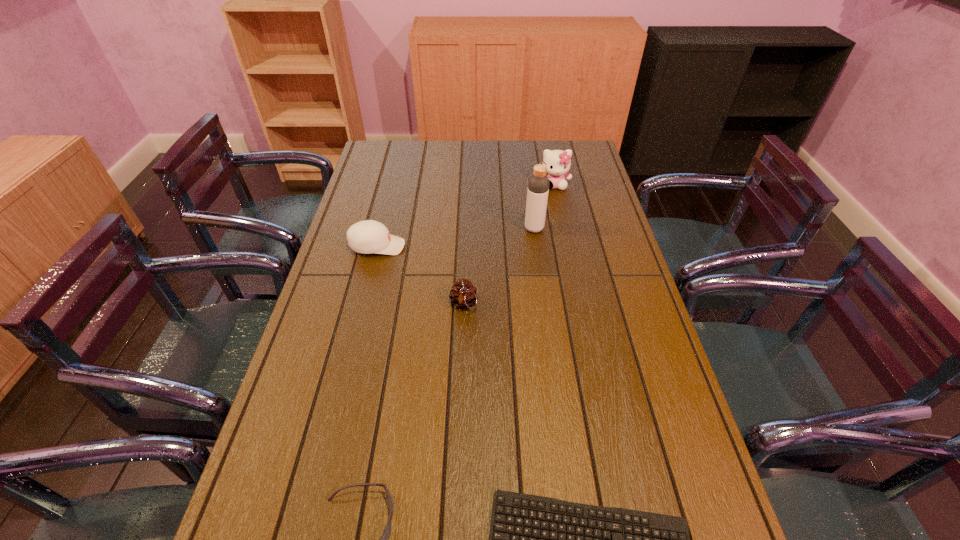
At what (x,y) coordinates should I click in order to perform the action: click on bottle. Please return your answer as a coordinate pair (x, y). Image resolution: width=960 pixels, height=540 pixels. Looking at the image, I should click on (538, 184).

Where is `the fifth shortest object`? This screenshot has width=960, height=540. the fifth shortest object is located at coordinates (558, 162).

At what (x,y) coordinates should I click in order to perform the action: click on the farthest object. Please return your answer as a coordinate pair (x, y). Looking at the image, I should click on (558, 162).

Locate an element on the screen. The height and width of the screenshot is (540, 960). baseball cap is located at coordinates (369, 236).

You are a GUI agent. You are given a task and a screenshot of the screen. Output one action in this format:
    pyautogui.click(x=<x>, y=<y>)
    Task: Click on the pinecone
    The image size is (960, 540).
    Given the screenshot: What is the action you would take?
    pyautogui.click(x=463, y=294)

I want to click on the third object from left to right, so click(463, 294).

This screenshot has height=540, width=960. What are the coordinates of `free space located on the right of the tallest object` in the screenshot? It's located at (606, 229).

Locate an element on the screen. The width and height of the screenshot is (960, 540). free spot located on the front-facing side of the kitten is located at coordinates (565, 241).

Locate an element on the screen. free space located 0.260m on the front-facing side of the baseball cap is located at coordinates pyautogui.click(x=485, y=246).

Find the location of a particular element. vacant space located 0.230m with a leaf charm attached to the fourth object from right to left is located at coordinates (460, 391).